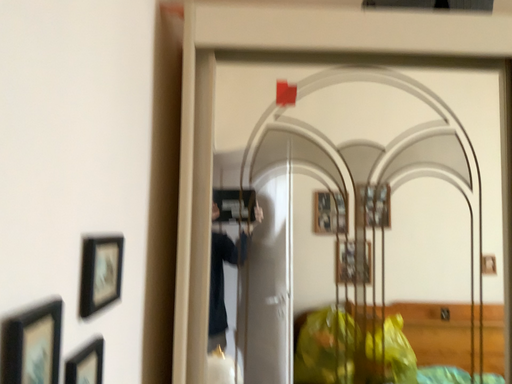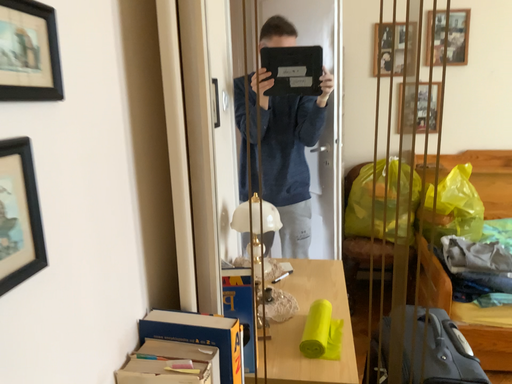
Question: How did the camera likely rotate when shooting the video?

Choices:
 (A) rotated left
 (B) rotated right

Answer: (A)